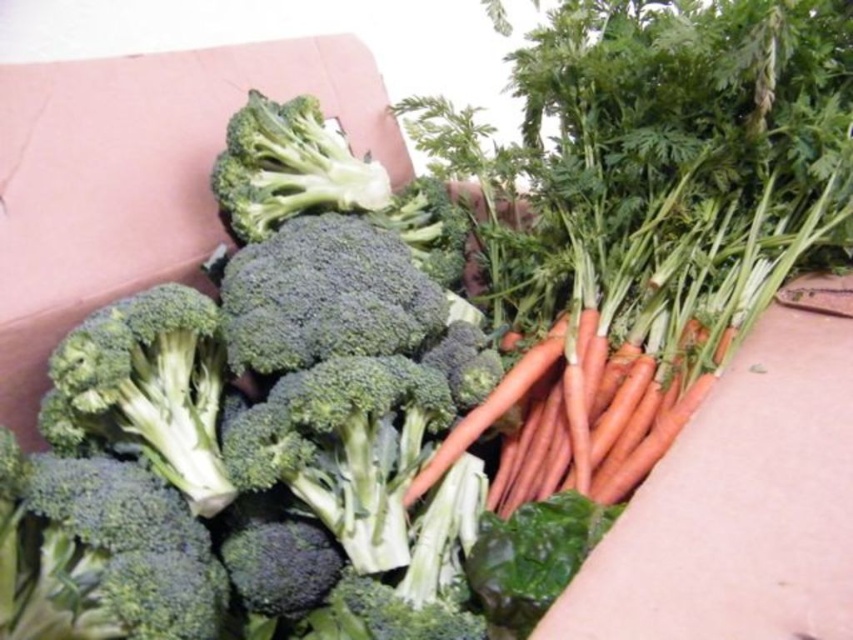
Question: Can you confirm if green matte broccoli at center is bigger than orange smooth carrot at center?

Choices:
 (A) yes
 (B) no

Answer: (A)

Question: Which of these objects is positioned closest to the orange smooth carrot at center?

Choices:
 (A) green fresh broccoli at upper center
 (B) green matte broccoli at center
 (C) green matte broccoli at left

Answer: (B)

Question: Is green matte broccoli at left positioned at the back of orange smooth carrot at center?

Choices:
 (A) no
 (B) yes

Answer: (A)

Question: Which object is closer to the camera taking this photo?

Choices:
 (A) green matte broccoli at left
 (B) orange smooth carrot at center
 (C) green matte broccoli at center
 (D) green fresh broccoli at upper center

Answer: (C)

Question: Which point is closer to the camera?

Choices:
 (A) (271, 202)
 (B) (279, 104)

Answer: (A)

Question: Is green matte broccoli at left smaller than green fresh broccoli at upper center?

Choices:
 (A) no
 (B) yes

Answer: (A)